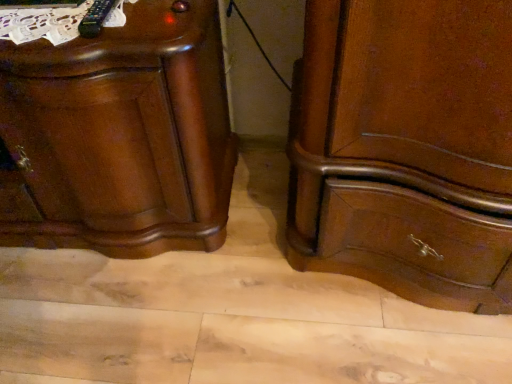
Locate an element on the screen. This screenshot has width=512, height=384. free space in front of matte wood chest of drawers at left is located at coordinates (110, 314).